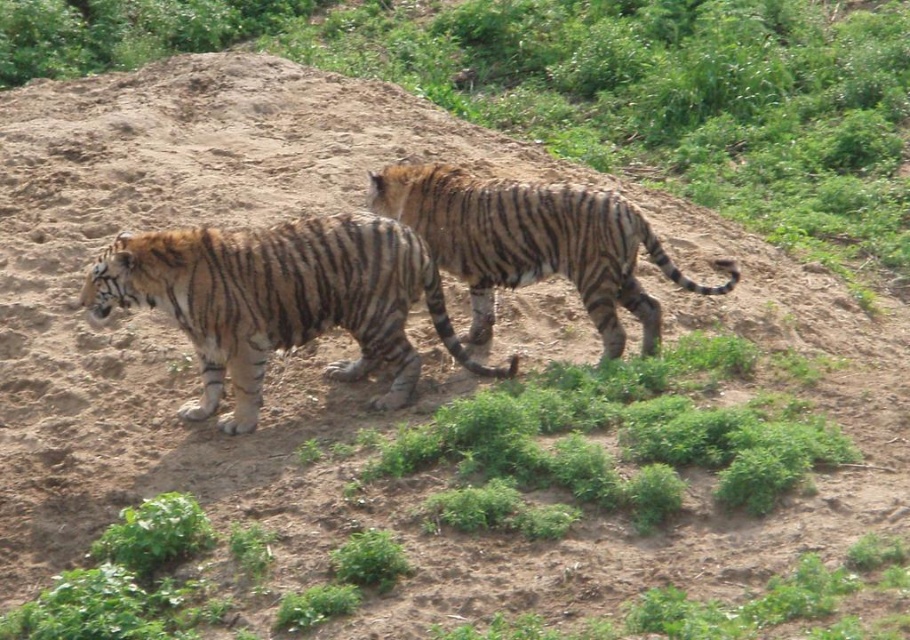
Question: Considering the relative positions of orange-brown striped tiger at center and striped fur tiger at center in the image provided, where is orange-brown striped tiger at center located with respect to striped fur tiger at center?

Choices:
 (A) right
 (B) left

Answer: (B)

Question: Does orange-brown striped tiger at center have a greater width compared to striped fur tiger at center?

Choices:
 (A) yes
 (B) no

Answer: (A)

Question: Which point is farther to the camera?

Choices:
 (A) striped fur tiger at center
 (B) orange-brown striped tiger at center

Answer: (A)

Question: Among these points, which one is farthest from the camera?

Choices:
 (A) (239, 381)
 (B) (658, 252)

Answer: (B)

Question: Is orange-brown striped tiger at center wider than striped fur tiger at center?

Choices:
 (A) yes
 (B) no

Answer: (A)